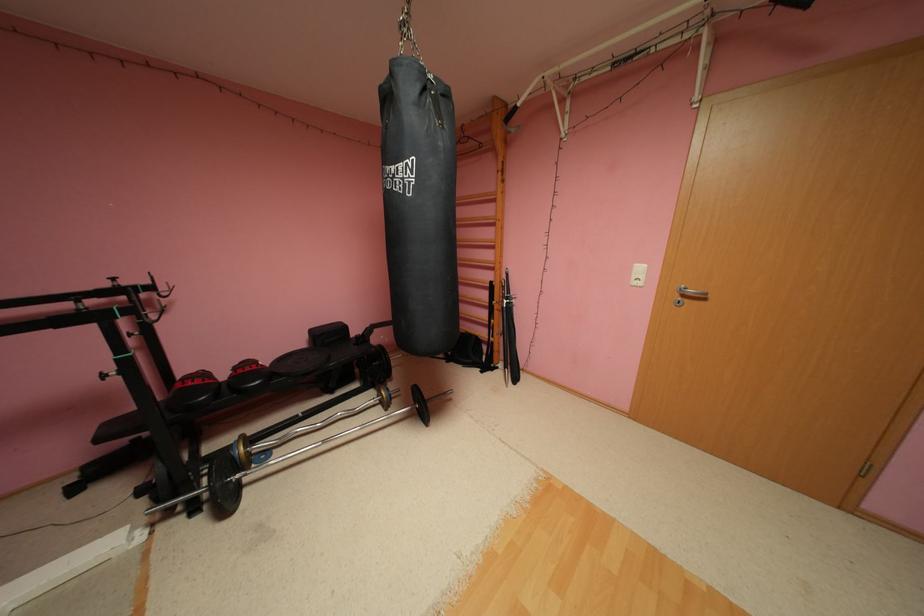
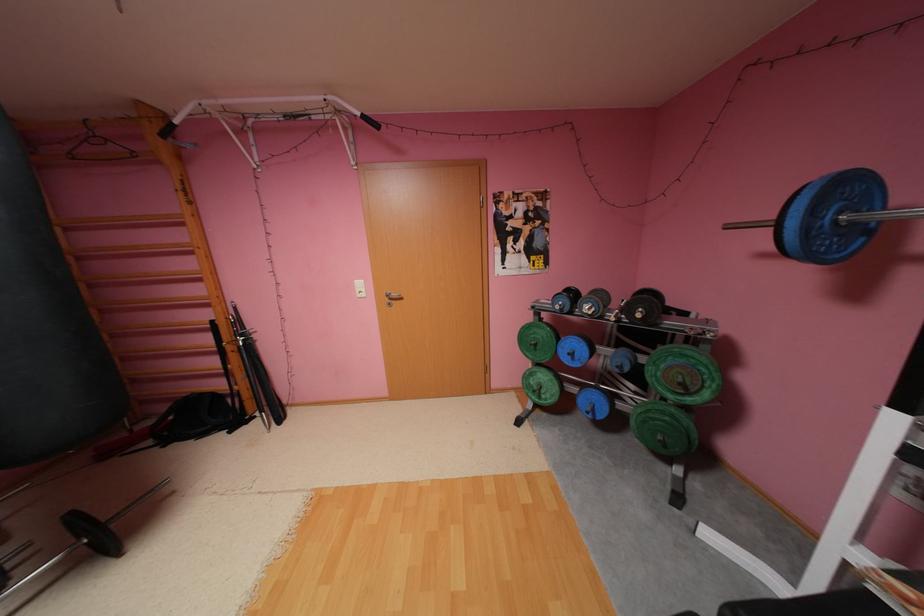
Where in the second image is the point corresponding to pixel 495 217 from the first image?

(187, 245)